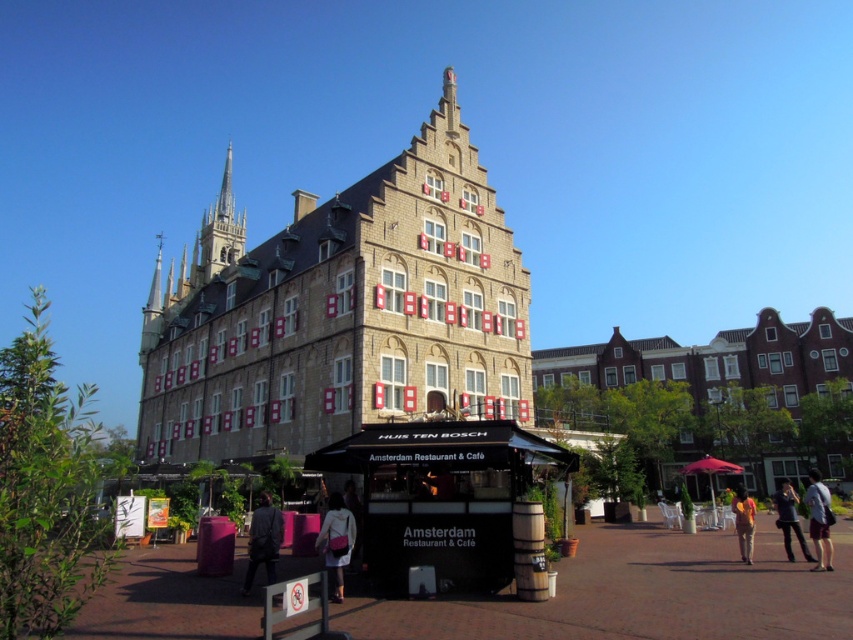
Which is in front, point (512, 346) or point (775, 506)?

Point (512, 346) is more forward.

The image size is (853, 640). Describe the element at coordinates (345, 316) in the screenshot. I see `beige stone building at center` at that location.

Is point (187, 452) less distant than point (779, 500)?

No, it is not.

You are a GUI agent. You are given a task and a screenshot of the screen. Output one action in this format:
    pyautogui.click(x=<x>, y=<y>)
    Task: Click on the beige stone building at center
    
    Given the screenshot: What is the action you would take?
    pyautogui.click(x=345, y=316)

Where is `matte pink purse at center`? This screenshot has height=640, width=853. matte pink purse at center is located at coordinates (335, 541).

Does point (271, 513) come behind point (811, 492)?

No, (271, 513) is in front of (811, 492).

Who is more distant from viewer, (x=271, y=573) or (x=811, y=522)?

The point (x=811, y=522) is behind.

Image resolution: width=853 pixels, height=640 pixels. I want to click on dark gray suit at center, so click(263, 540).